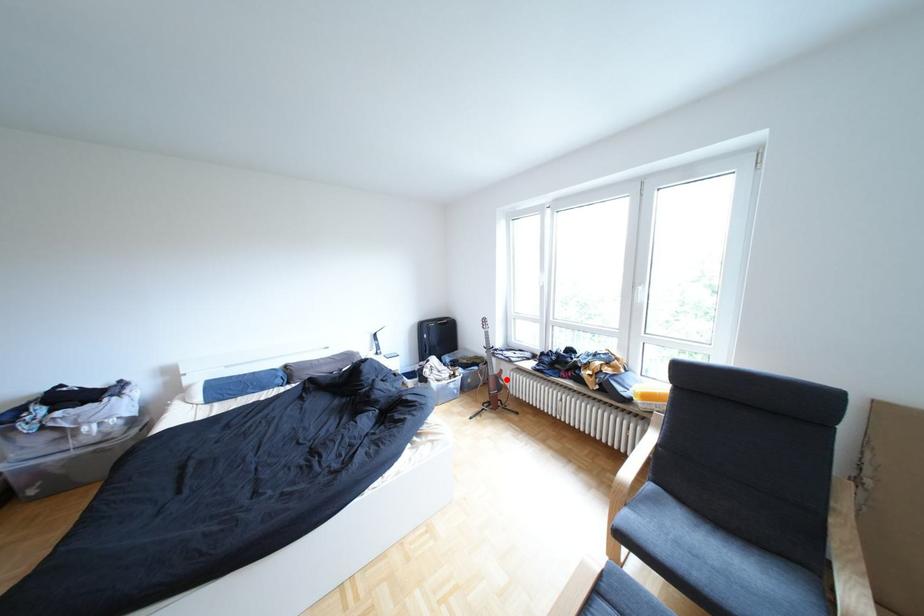
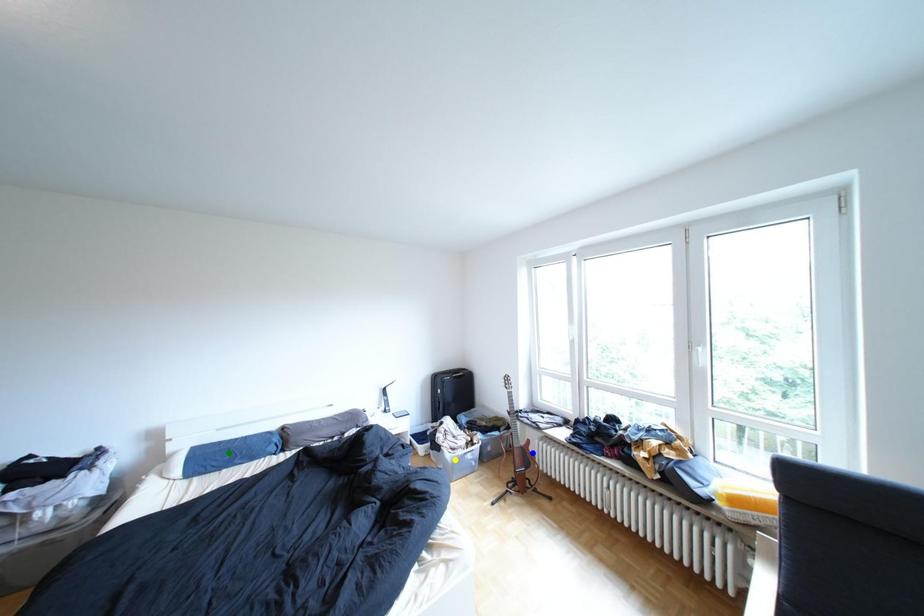
Question: I am providing you with two images of the same scene from different viewpoints. A red point is marked on the first image. You are given multiple points on the second image. Which mark in image 2 goes with the point in image 1?

Choices:
 (A) yellow point
 (B) blue point
 (C) green point

Answer: (B)